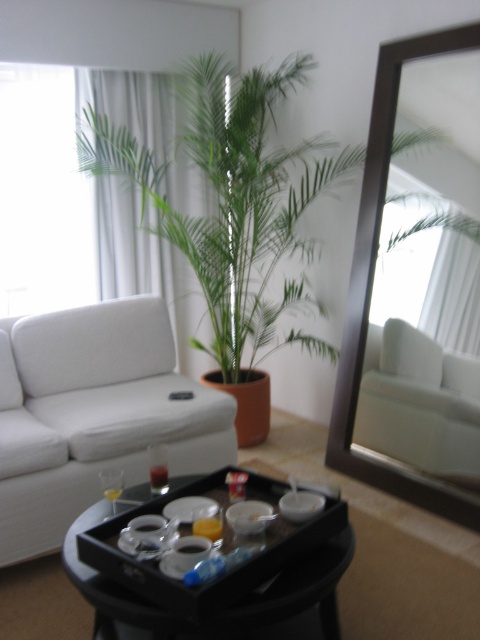
Question: Is white fabric couch at left bigger than brown wooden mirror at upper right?

Choices:
 (A) yes
 (B) no

Answer: (A)

Question: Is brown wooden mirror at upper right above white fabric couch at center?

Choices:
 (A) yes
 (B) no

Answer: (A)

Question: Estimate the real-world distances between objects in this image. Which object is farther from the translucent glass tray at center?

Choices:
 (A) white fabric couch at center
 (B) white fabric couch at left

Answer: (A)

Question: From the image, what is the correct spatial relationship of white fabric couch at left in relation to white fabric couch at center?

Choices:
 (A) right
 (B) left

Answer: (B)

Question: Which of the following is the closest to the observer?

Choices:
 (A) brown wooden mirror at upper right
 (B) white fabric couch at center
 (C) white fabric couch at left
 (D) translucent glass tray at center

Answer: (D)

Question: Which object is farther from the camera taking this photo?

Choices:
 (A) white fabric couch at center
 (B) translucent glass tray at center
 (C) white fabric couch at left
 (D) brown wooden mirror at upper right

Answer: (A)